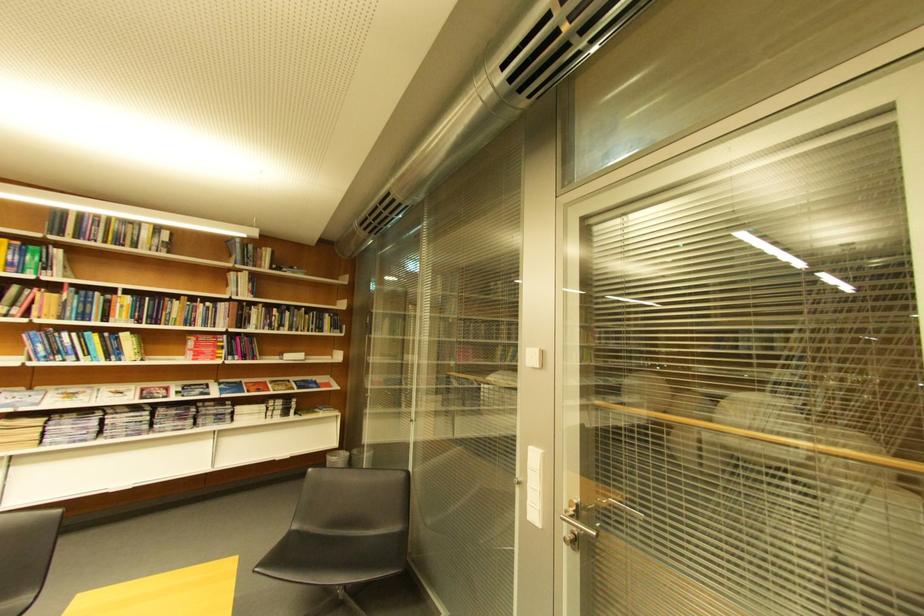
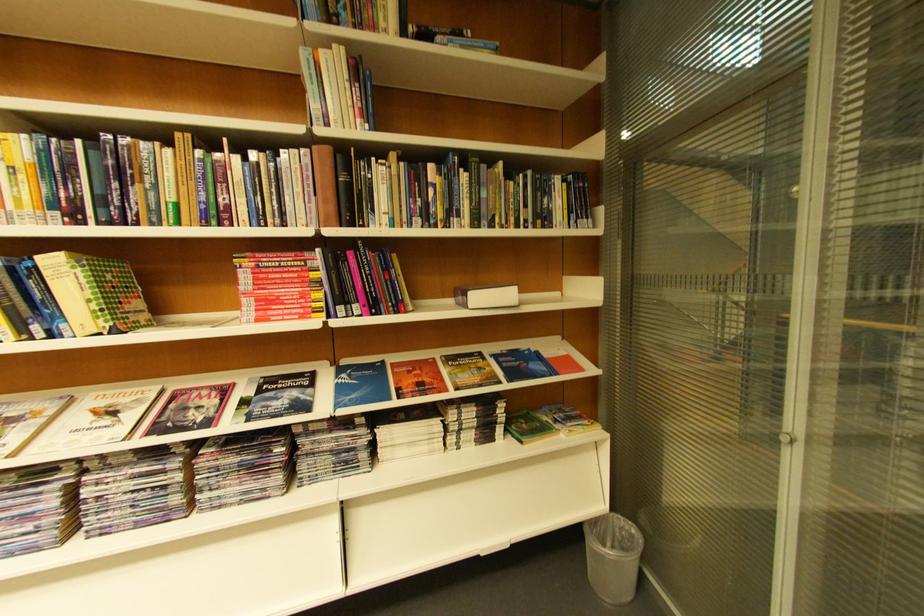
In the second image, find the point that corresponds to point 271,268 in the first image.

(384, 31)